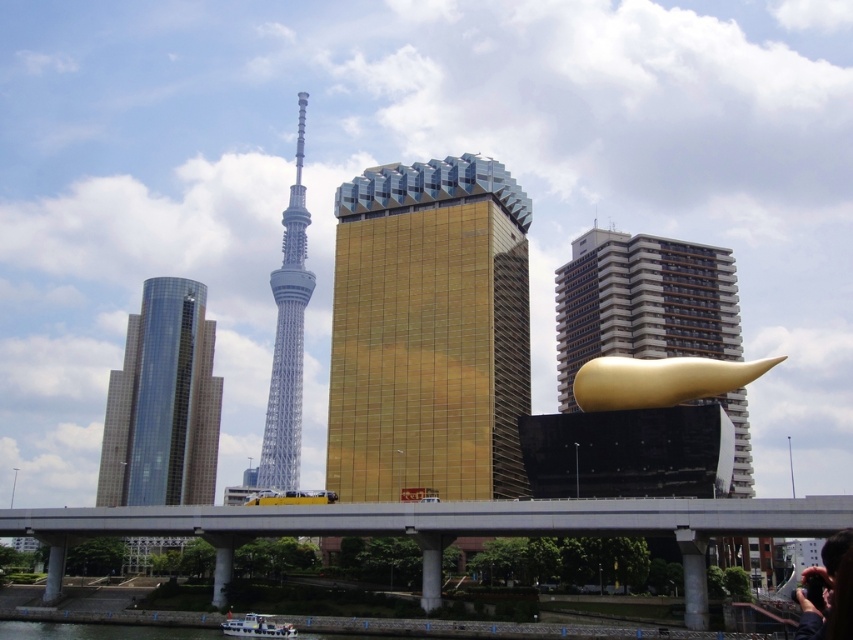
Between gold reflective sculpture at center-right and white plastic boat at lower left, which one has more height?

gold reflective sculpture at center-right

Between point (695, 342) and point (264, 616), which one is positioned in front?

Positioned in front is point (264, 616).

Where is `gold reflective sculpture at center-right`? gold reflective sculpture at center-right is located at coordinates (642, 301).

Between shiny glass skyscraper at left and silver metallic tower at center, which one has less height?

shiny glass skyscraper at left

Can you confirm if shiny glass skyscraper at left is positioned to the left of silver metallic tower at center?

Yes, shiny glass skyscraper at left is to the left of silver metallic tower at center.

This screenshot has height=640, width=853. In order to click on shiny glass skyscraper at left in this screenshot , I will do `click(163, 403)`.

From the picture: Can you confirm if gold reflective sculpture at center-right is positioned above silver metallic tower at center?

Actually, gold reflective sculpture at center-right is below silver metallic tower at center.

Is gold reflective sculpture at center-right smaller than silver metallic tower at center?

Yes, gold reflective sculpture at center-right is smaller than silver metallic tower at center.

Does point (585, 272) come closer to viewer compared to point (285, 340)?

Yes, point (585, 272) is closer to viewer.

Where is `gold reflective sculpture at center-right`? gold reflective sculpture at center-right is located at coordinates (642, 301).